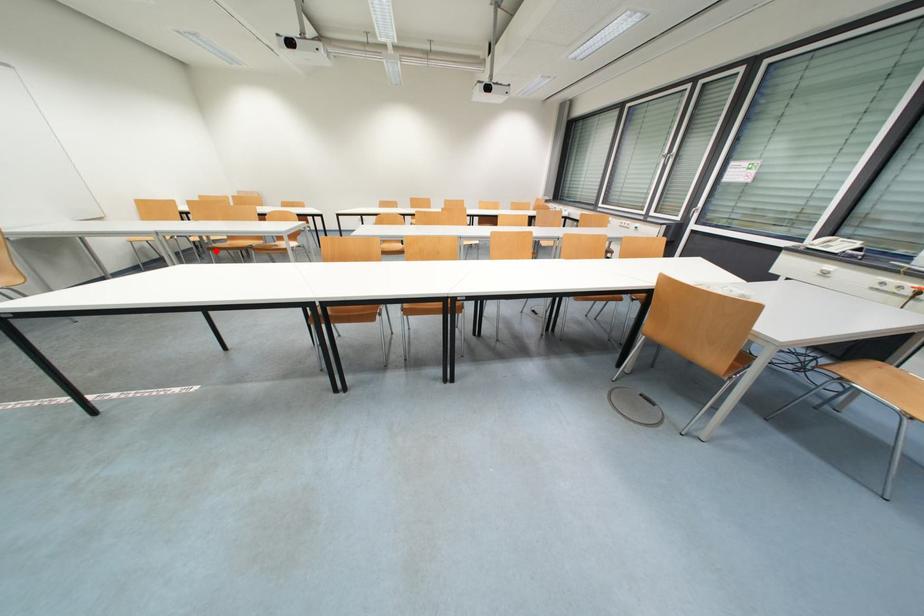
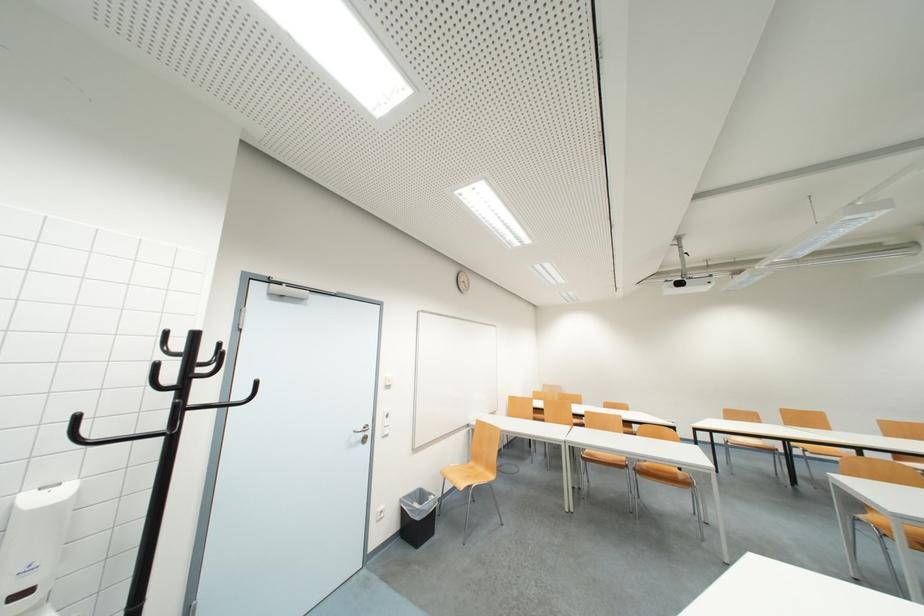
Question: I am providing you with two images of the same scene from different viewpoints. Image1 has a red point marked. In image2, the corresponding 3D location appears at what relative position? Reply with the corresponding letter.

Choices:
 (A) Closer
 (B) Farther

Answer: (B)